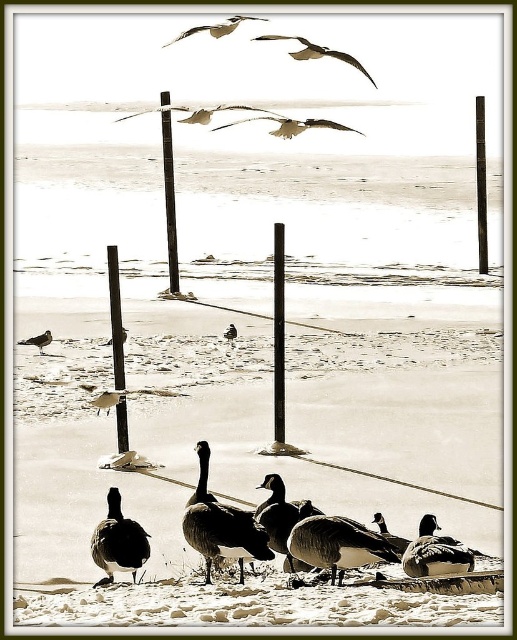
Does black wood post at center have a greater width compared to brown feathered duck at center?

In fact, black wood post at center might be narrower than brown feathered duck at center.

Which is above, black wood post at center or brown feathered duck at center?

black wood post at center is above.

Describe the element at coordinates (279, 333) in the screenshot. The image size is (517, 640). I see `black wood post at center` at that location.

The image size is (517, 640). Identify the location of black wood post at center. 279,333.

Is black wood post at center positioned at the back of black wood post at center-left?

Yes, it is.

Who is more distant from viewer, (281, 413) or (114, 321)?

Positioned behind is point (281, 413).

Is point (279, 368) closer to viewer compared to point (109, 285)?

That is True.

Image resolution: width=517 pixels, height=640 pixels. Identify the location of black wood post at center. (279, 333).

Does silhouette feathered duck at lower left have a greater width compared to brown feathered duck at center?

No, silhouette feathered duck at lower left is not wider than brown feathered duck at center.

Is silhouette feathered duck at lower left thinner than brown feathered duck at center?

Correct, silhouette feathered duck at lower left's width is less than brown feathered duck at center's.

Is point (123, 552) farther from camera compared to point (278, 552)?

No, (123, 552) is in front of (278, 552).

I want to click on silhouette feathered duck at lower left, so click(x=117, y=541).